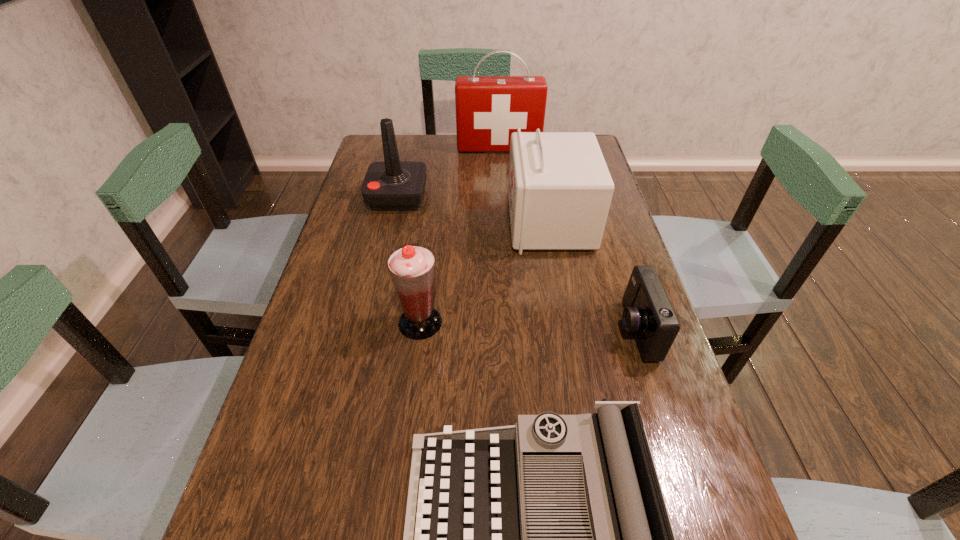
Where is `the taller first-aid kit`? The height and width of the screenshot is (540, 960). the taller first-aid kit is located at coordinates (489, 109).

Where is `the farthest object`? The image size is (960, 540). the farthest object is located at coordinates (489, 109).

The height and width of the screenshot is (540, 960). In order to click on the nearer first-aid kit in this screenshot , I will do `click(559, 189)`.

Locate an element on the screen. The image size is (960, 540). joystick is located at coordinates (391, 185).

Identify the location of smoothie. The image size is (960, 540). (412, 267).

What are the coordinates of `camera` in the screenshot? It's located at (648, 313).

The height and width of the screenshot is (540, 960). Identify the location of vacant space situated 0.140m on the front face of the farthest object. (500, 176).

You are a GUI agent. You are given a task and a screenshot of the screen. Output one action in this format:
    pyautogui.click(x=<x>, y=<y>)
    Task: Click on the vacant space located 0.150m on the front-facing side of the shorter first-aid kit
    
    Given the screenshot: What is the action you would take?
    pyautogui.click(x=459, y=222)

Locate an element on the screen. vacant space situated 0.170m on the front-facing side of the shorter first-aid kit is located at coordinates (451, 222).

At what (x,y) coordinates should I click in order to perform the action: click on vacant space located 0.300m on the front-facing side of the shorter first-aid kit. Please return your answer as a coordinate pair (x, y). The width and height of the screenshot is (960, 540). Looking at the image, I should click on (407, 222).